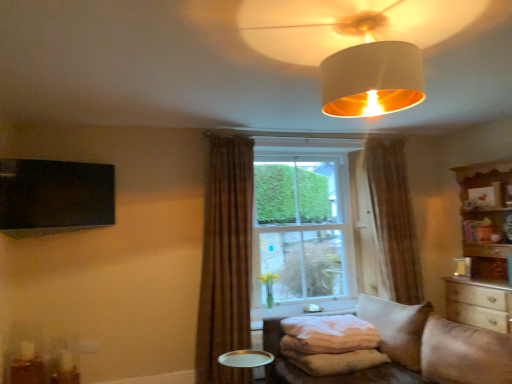
Question: From the image's perspective, does brown sheer curtain at center, which is counted as the second curtain, starting from the front, appear lower than beige fabric studio couch at lower right?

Choices:
 (A) no
 (B) yes

Answer: (A)

Question: Is brown sheer curtain at center, which is counted as the second curtain, starting from the left, oriented towards beige fabric studio couch at lower right?

Choices:
 (A) yes
 (B) no

Answer: (B)

Question: Can we say brown sheer curtain at center, which is counted as the second curtain, starting from the left, lies outside beige fabric studio couch at lower right?

Choices:
 (A) no
 (B) yes

Answer: (B)

Question: Is brown sheer curtain at center, placed as the 1th curtain when sorted from back to front, shorter than beige fabric studio couch at lower right?

Choices:
 (A) no
 (B) yes

Answer: (A)

Question: From a real-world perspective, is brown sheer curtain at center, the first curtain in the right-to-left sequence, positioned under beige fabric studio couch at lower right based on gravity?

Choices:
 (A) yes
 (B) no

Answer: (B)

Question: Is brown sheer curtain at center, which is counted as the second curtain, starting from the front, wider than beige fabric studio couch at lower right?

Choices:
 (A) yes
 (B) no

Answer: (B)

Question: Is wooden cabinet at right not close to metallic silver tray at lower center?

Choices:
 (A) no
 (B) yes

Answer: (B)

Question: Is wooden cabinet at right at the right side of metallic silver tray at lower center?

Choices:
 (A) no
 (B) yes

Answer: (B)

Question: From the image's perspective, does wooden cabinet at right appear lower than metallic silver tray at lower center?

Choices:
 (A) yes
 (B) no

Answer: (B)

Question: From a real-world perspective, is wooden cabinet at right on metallic silver tray at lower center?

Choices:
 (A) yes
 (B) no

Answer: (A)

Question: Considering the relative positions of wooden cabinet at right and metallic silver tray at lower center in the image provided, is wooden cabinet at right to the left of metallic silver tray at lower center from the viewer's perspective?

Choices:
 (A) yes
 (B) no

Answer: (B)

Question: From a real-world perspective, does wooden cabinet at right sit lower than metallic silver tray at lower center?

Choices:
 (A) no
 (B) yes

Answer: (A)

Question: Does metallic silver tray at lower center have a greater height compared to white soft pillow at lower center?

Choices:
 (A) no
 (B) yes

Answer: (B)